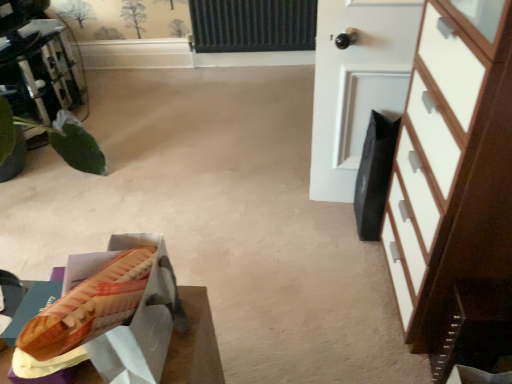
Question: Could green leafy plant at left be considered to be inside white matte door at upper right?

Choices:
 (A) yes
 (B) no

Answer: (B)

Question: Is white matte door at upper right closer to the viewer compared to green leafy plant at left?

Choices:
 (A) yes
 (B) no

Answer: (A)

Question: Does white matte door at upper right have a larger size compared to green leafy plant at left?

Choices:
 (A) no
 (B) yes

Answer: (A)

Question: Considering the relative sizes of white matte door at upper right and green leafy plant at left in the image provided, is white matte door at upper right taller than green leafy plant at left?

Choices:
 (A) yes
 (B) no

Answer: (A)

Question: From the image's perspective, does white matte door at upper right appear lower than green leafy plant at left?

Choices:
 (A) yes
 (B) no

Answer: (A)

Question: From the image's perspective, is white matte door at upper right on green leafy plant at left?

Choices:
 (A) yes
 (B) no

Answer: (B)

Question: Is matte brown hot dog bun at lower left shorter than green leafy plant at left?

Choices:
 (A) yes
 (B) no

Answer: (A)

Question: Could you tell me if matte brown hot dog bun at lower left is facing green leafy plant at left?

Choices:
 (A) no
 (B) yes

Answer: (A)

Question: Can you confirm if matte brown hot dog bun at lower left is wider than green leafy plant at left?

Choices:
 (A) yes
 (B) no

Answer: (B)

Question: Does matte brown hot dog bun at lower left appear on the left side of green leafy plant at left?

Choices:
 (A) no
 (B) yes

Answer: (A)

Question: Does matte brown hot dog bun at lower left appear on the right side of green leafy plant at left?

Choices:
 (A) yes
 (B) no

Answer: (A)

Question: From the image's perspective, does matte brown hot dog bun at lower left appear higher than green leafy plant at left?

Choices:
 (A) yes
 (B) no

Answer: (B)

Question: Can you confirm if white wood chest of drawers at right is thinner than white matte door at upper right?

Choices:
 (A) yes
 (B) no

Answer: (B)